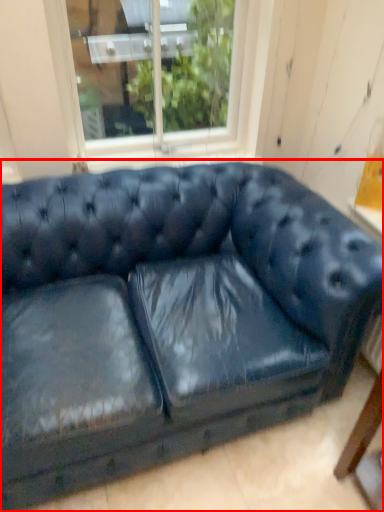
Question: Considering the relative positions of studio couch (annotated by the red box) and window in the image provided, where is studio couch (annotated by the red box) located with respect to the staircase?

Choices:
 (A) left
 (B) right

Answer: (B)